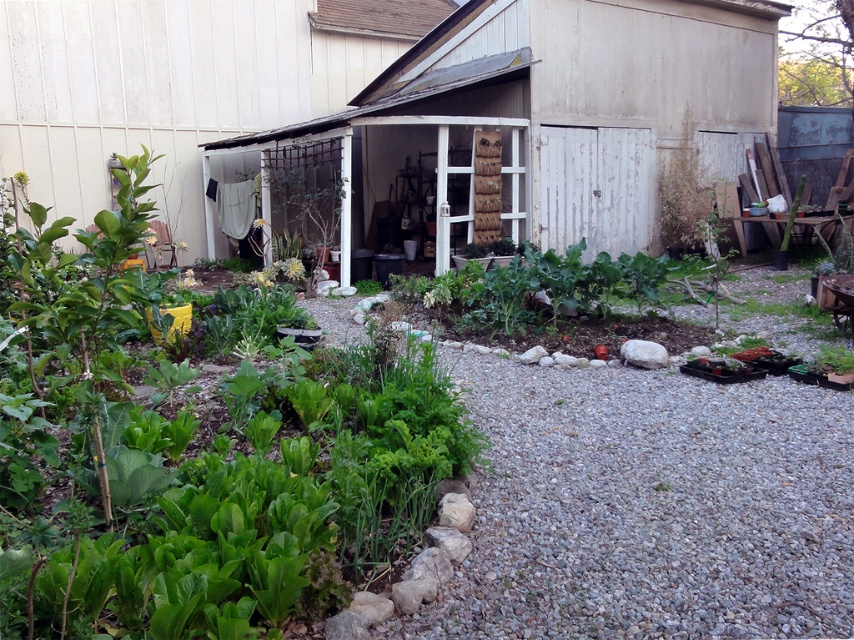
Can you confirm if white wooden shed at center is positioned to the right of white wood shed at center?

Correct, you'll find white wooden shed at center to the right of white wood shed at center.

Does white wooden shed at center have a smaller size compared to white wood shed at center?

No, white wooden shed at center is not smaller than white wood shed at center.

Find the location of a particular element. The width and height of the screenshot is (854, 640). white wooden shed at center is located at coordinates click(x=547, y=120).